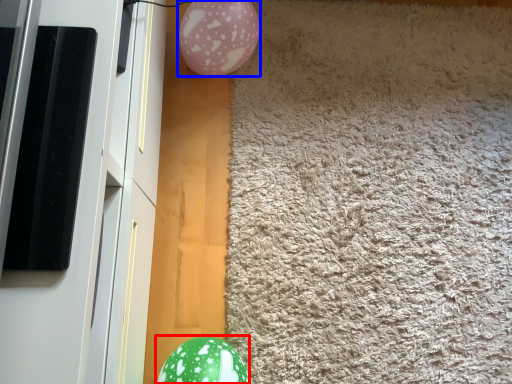
Question: Which object appears closest to the camera in this image, egg (highlighted by a red box) or balloon (highlighted by a blue box)?

Choices:
 (A) egg
 (B) balloon

Answer: (A)